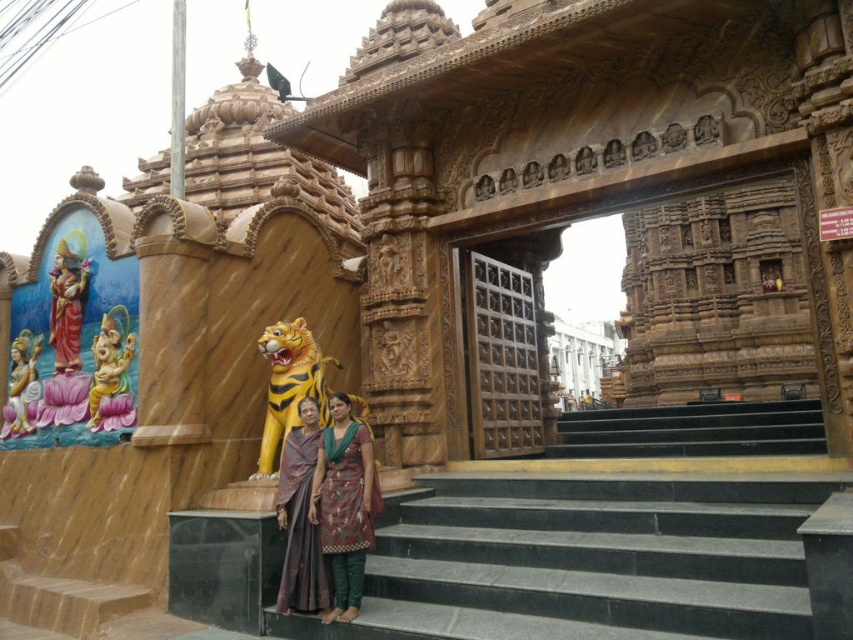
Question: Among these objects, which one is nearest to the camera?

Choices:
 (A) golden statue at left
 (B) golden stone elephant at lower left
 (C) yellow painted wood tiger statue at center

Answer: (C)

Question: Does yellow painted wood tiger statue at center appear under golden statue at left?

Choices:
 (A) yes
 (B) no

Answer: (A)

Question: Can you confirm if black marble stairs at center is smaller than yellow painted wood tiger statue at center?

Choices:
 (A) yes
 (B) no

Answer: (B)

Question: Which point is closer to the camera?

Choices:
 (A) (x=334, y=538)
 (B) (x=787, y=426)

Answer: (A)

Question: Considering the relative positions of yellow painted wood tiger statue at center and polished gold statue at left in the image provided, where is yellow painted wood tiger statue at center located with respect to polished gold statue at left?

Choices:
 (A) above
 (B) below

Answer: (B)

Question: Which is farther from the golden statue at left?

Choices:
 (A) purple silk saree at lower center
 (B) golden stone elephant at lower left
 (C) black granite stairs at center

Answer: (C)